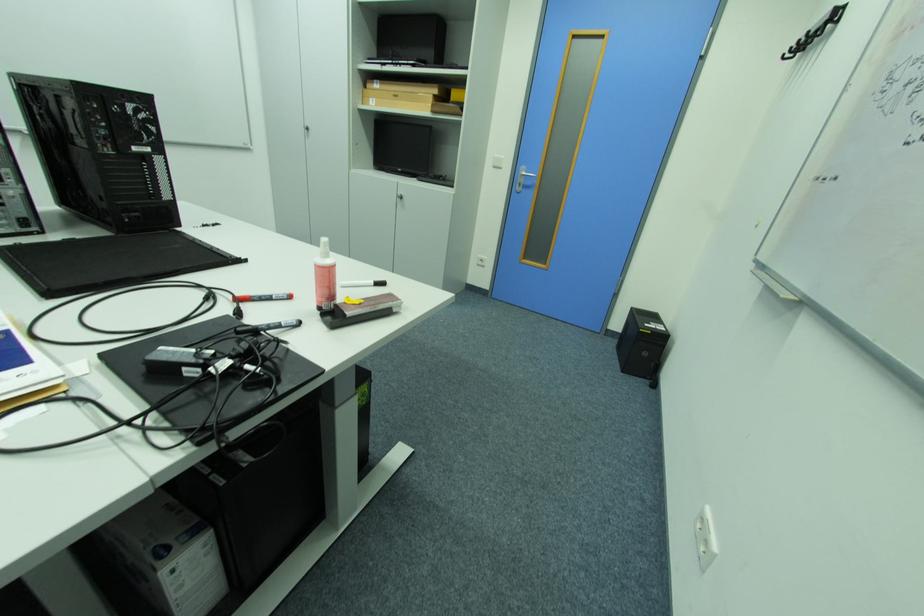
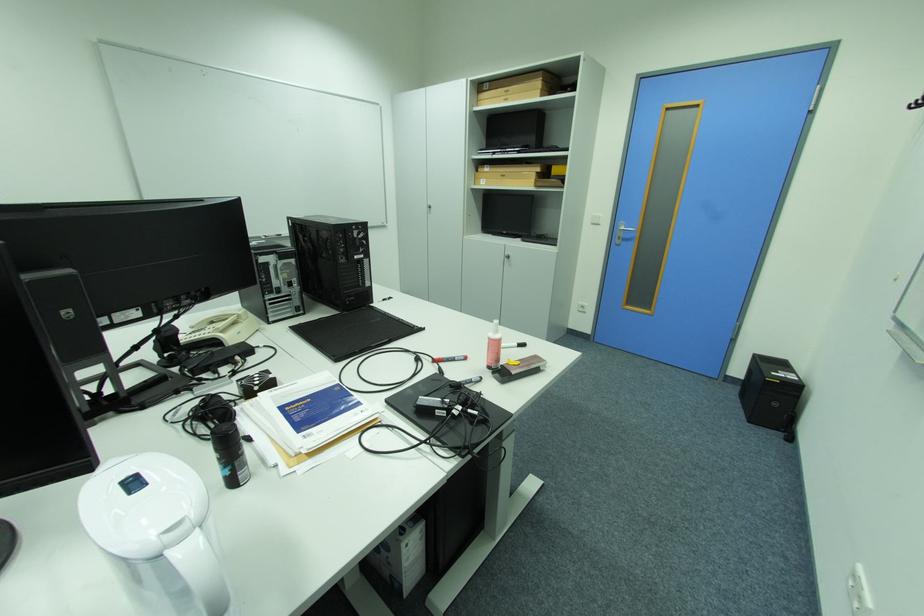
Locate, in the second image, the point that corresponds to the point at 185,246 in the first image.

(386, 320)